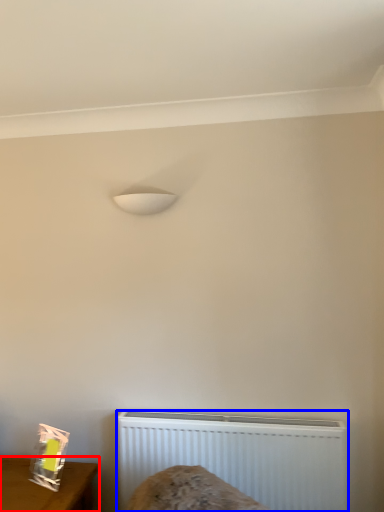
Question: Which point is further to the camera, furniture (highlighted by a red box) or radiator (highlighted by a blue box)?

Choices:
 (A) furniture
 (B) radiator

Answer: (B)